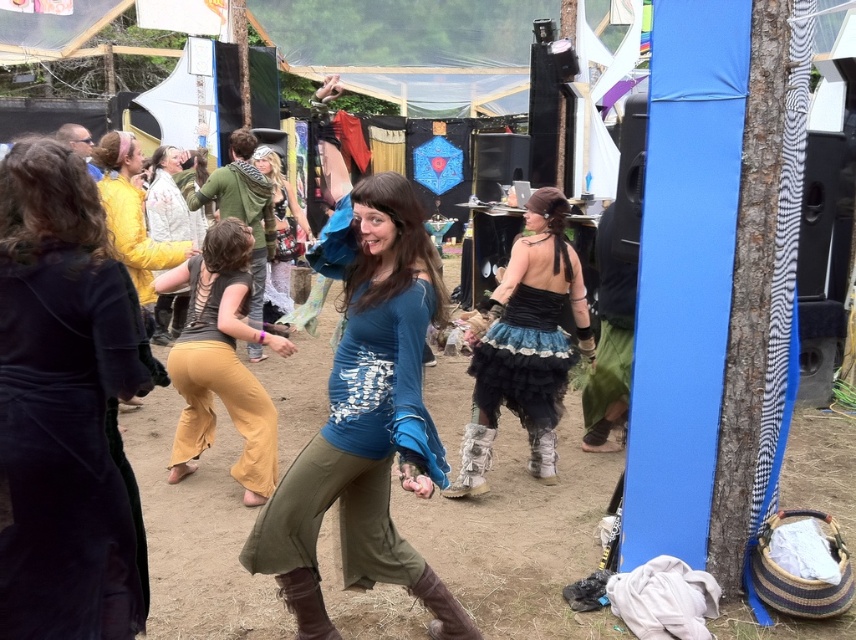
You are organizing a costume party and need to decide which outfit to wear. You have the blue cotton shirt at center and the matte lace dress at center. If you want to wear the larger one, which should you choose?

The blue cotton shirt at center is larger in size than the matte lace dress at center, so you should choose the blue cotton shirt at center.

In the scene shown: You are organizing a costume party and need to ensure that the outfits are proportional. Given the blue cotton shirt at center and the matte brown pants at center, which one should you adjust if you want both to be the same size?

The blue cotton shirt at center is bigger than the matte brown pants at center. To make them the same size, you should reduce the size of the blue cotton shirt at center.